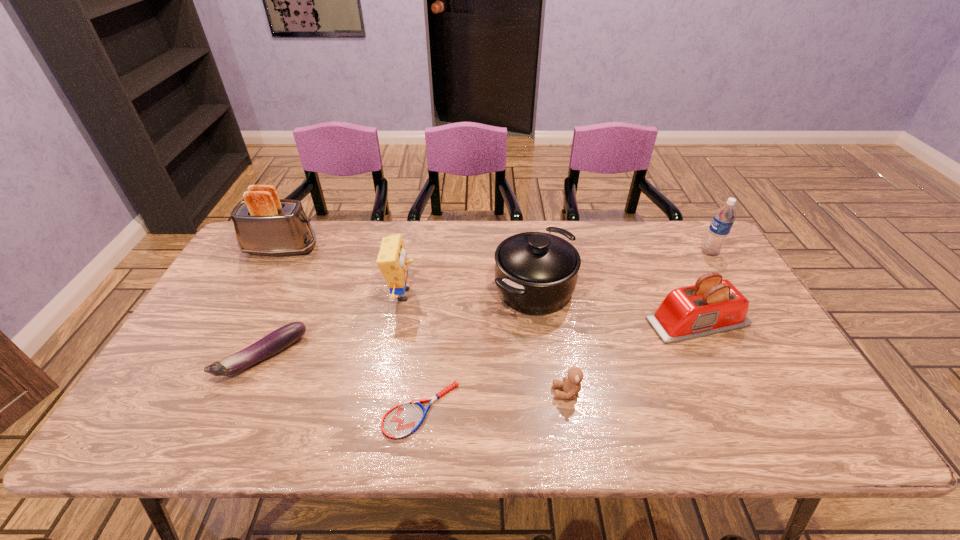
The height and width of the screenshot is (540, 960). In the image, there is a desktop. In order to click on vacant space at the far edge in this screenshot , I will do `click(410, 235)`.

The height and width of the screenshot is (540, 960). Find the location of `free space at the near edge of the desktop`. free space at the near edge of the desktop is located at coordinates [x=584, y=436].

I want to click on free location at the left edge of the desktop, so click(x=206, y=384).

Where is `vacant space at the far right corner`? vacant space at the far right corner is located at coordinates (674, 235).

At what (x,y) coordinates should I click in order to perform the action: click on free space between the eggplant and the sponge. Please return your answer as a coordinate pair (x, y). This screenshot has width=960, height=540. Looking at the image, I should click on (333, 326).

The image size is (960, 540). I want to click on free space that is in between the left toaster and the shortest object, so click(x=351, y=329).

Image resolution: width=960 pixels, height=540 pixels. Find the location of `free space between the saucepan and the right toaster`. free space between the saucepan and the right toaster is located at coordinates (615, 305).

Locate an element on the screen. free spot between the eggplant and the nearer toaster is located at coordinates (480, 339).

Identify the location of free space between the sixth tallest object and the sponge. (485, 343).

This screenshot has width=960, height=540. I want to click on empty space that is in between the farther toaster and the sponge, so click(342, 272).